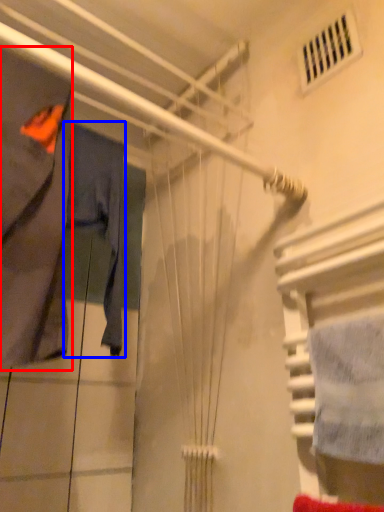
Question: Which object appears closest to the camera in this image, clothing (highlighted by a red box) or clothing (highlighted by a blue box)?

Choices:
 (A) clothing
 (B) clothing

Answer: (A)